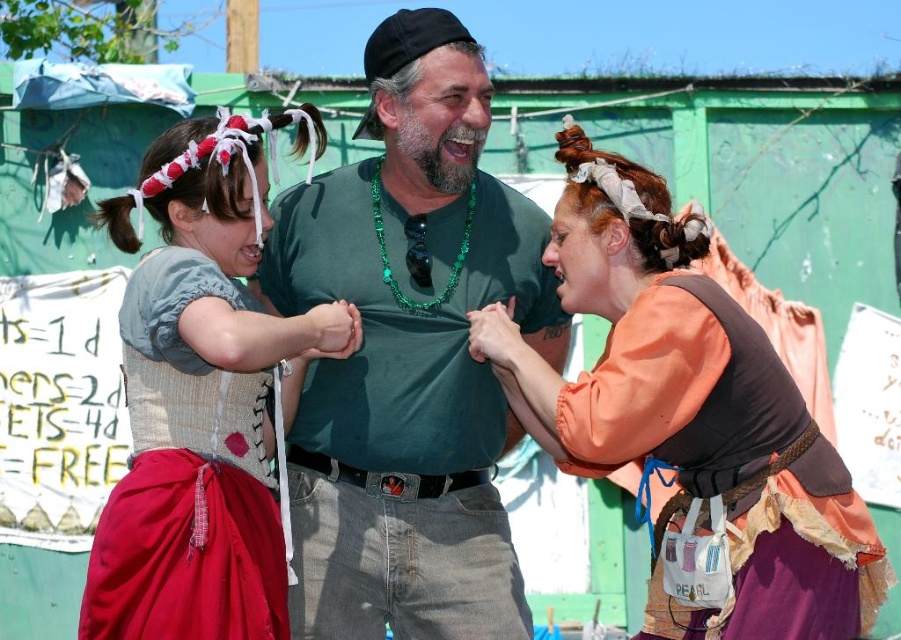
Looking at the festive scene, you notice the matte gray vest at center and the emerald green beaded necklace at center. Which one is positioned to the left?

The matte gray vest at center is to the left of the emerald green beaded necklace at center.

You are a photographer trying to capture a group photo of the orange fabric dress at center and the emerald green beaded necklace at center. The camera you are using has a maximum focus range of 7 meters. Will you be able to capture both subjects clearly in the same photo?

The orange fabric dress at center is 7.38 meters from the emerald green beaded necklace at center. Since the distance between them exceeds the camera maximum focus range of 7 meters, you won not be able to capture both subjects clearly in the same photo.

You are a costume designer preparing to adjust the size of the matte gray vest at center and the emerald green beaded necklace at center for a performance. Based on the scene description, which object requires more material to be added to match the other in size?

The matte gray vest at center is larger in size than the emerald green beaded necklace at center. Therefore, the emerald green beaded necklace at center requires more material to be added to match the size of the matte gray vest at center.